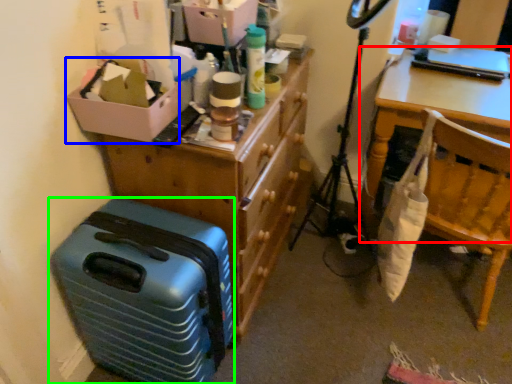
Question: Which is nearer to the desk (highlighted by a red box)? box (highlighted by a blue box) or suitcase (highlighted by a green box).

Choices:
 (A) box
 (B) suitcase

Answer: (A)